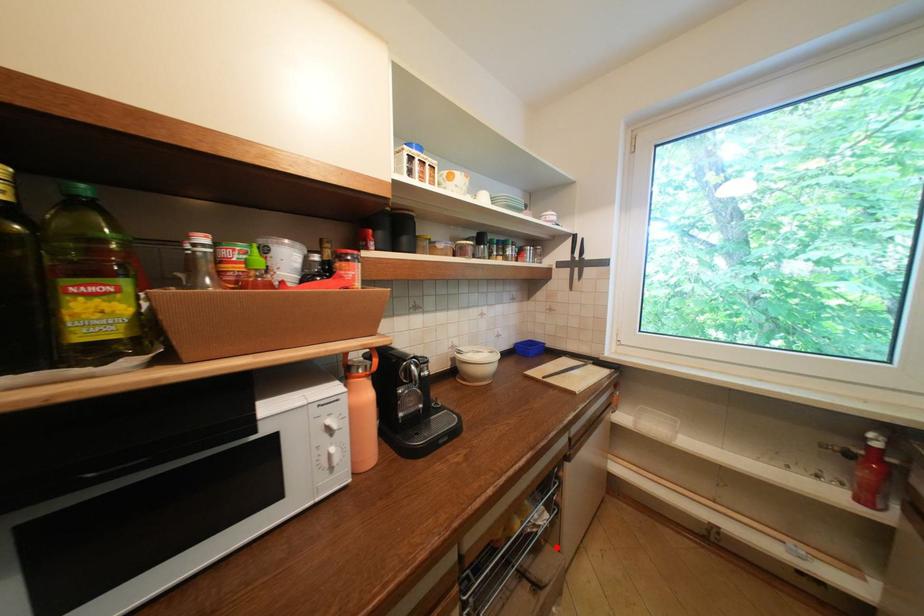
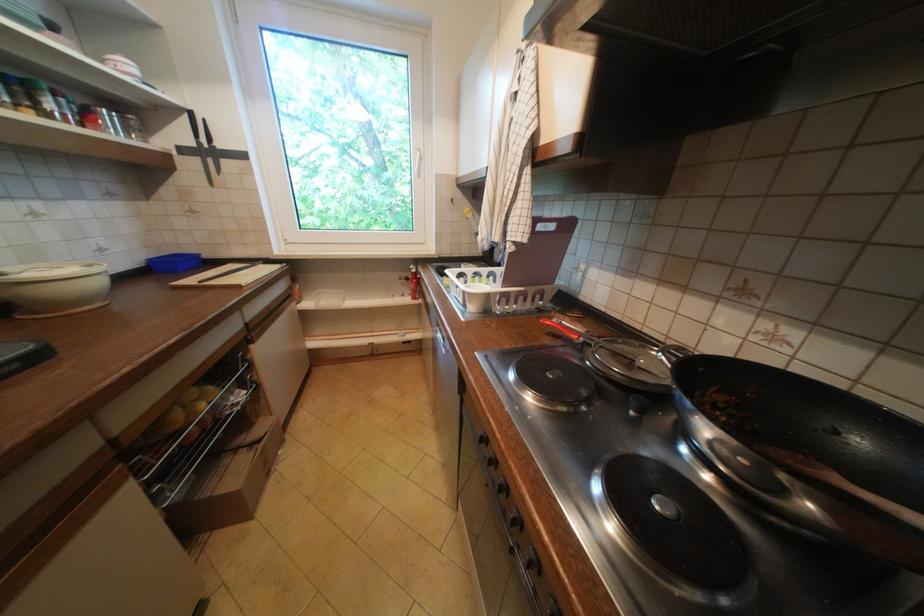
Locate, in the second image, the point that corresponds to the highlighted location in the first image.

(270, 419)